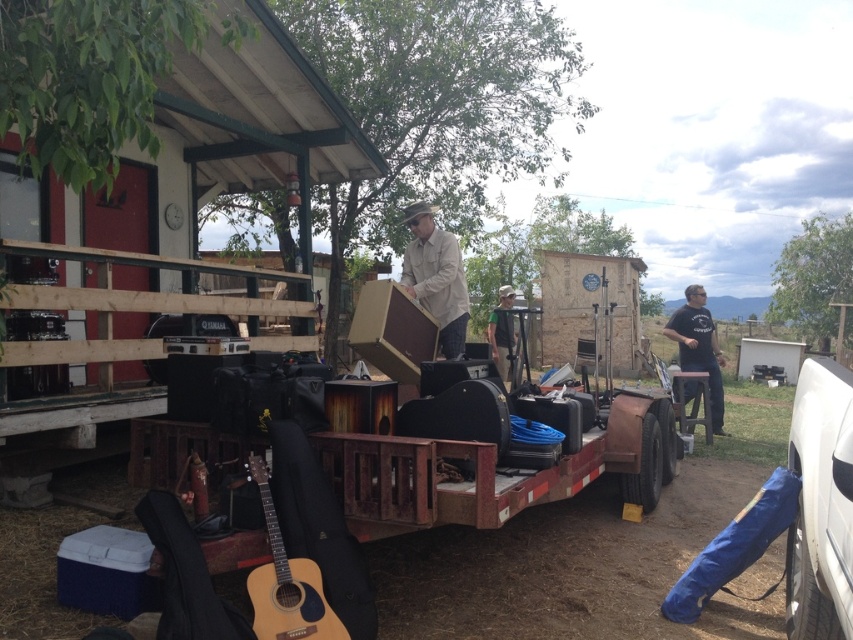
Which is more to the left, wooden hut at center or tan canvas guitar case at center?

tan canvas guitar case at center is more to the left.

Can you confirm if wooden hut at center is positioned below tan canvas guitar case at center?

Incorrect, wooden hut at center is not positioned below tan canvas guitar case at center.

Is point (631, 342) positioned after point (426, 209)?

That is True.

Locate an element on the screen. The height and width of the screenshot is (640, 853). wooden hut at center is located at coordinates (589, 305).

Can you confirm if wooden hut at center is bigger than black cotton shirt at right?

Correct, wooden hut at center is larger in size than black cotton shirt at right.

Can you confirm if wooden hut at center is smaller than black cotton shirt at right?

Incorrect, wooden hut at center is not smaller in size than black cotton shirt at right.

Where is `wooden hut at center`? This screenshot has height=640, width=853. wooden hut at center is located at coordinates (589, 305).

Does natural wood acoustic guitar at lower left appear on the right side of wooden stool at center?

Incorrect, natural wood acoustic guitar at lower left is not on the right side of wooden stool at center.

Can you confirm if natural wood acoustic guitar at lower left is smaller than wooden stool at center?

Yes, natural wood acoustic guitar at lower left is smaller than wooden stool at center.

What are the coordinates of `natural wood acoustic guitar at lower left` in the screenshot? It's located at (286, 582).

I want to click on natural wood acoustic guitar at lower left, so click(286, 582).